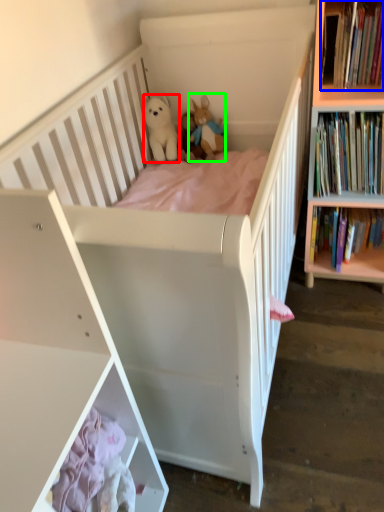
Question: Considering the real-world distances, which object is farthest from toy (highlighted by a red box)? book (highlighted by a blue box) or toy (highlighted by a green box)?

Choices:
 (A) book
 (B) toy

Answer: (A)